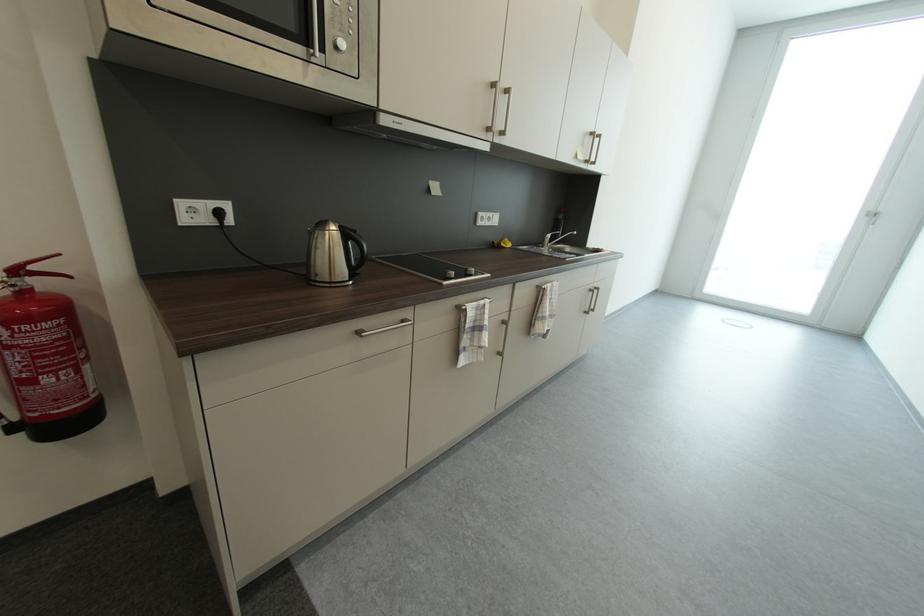
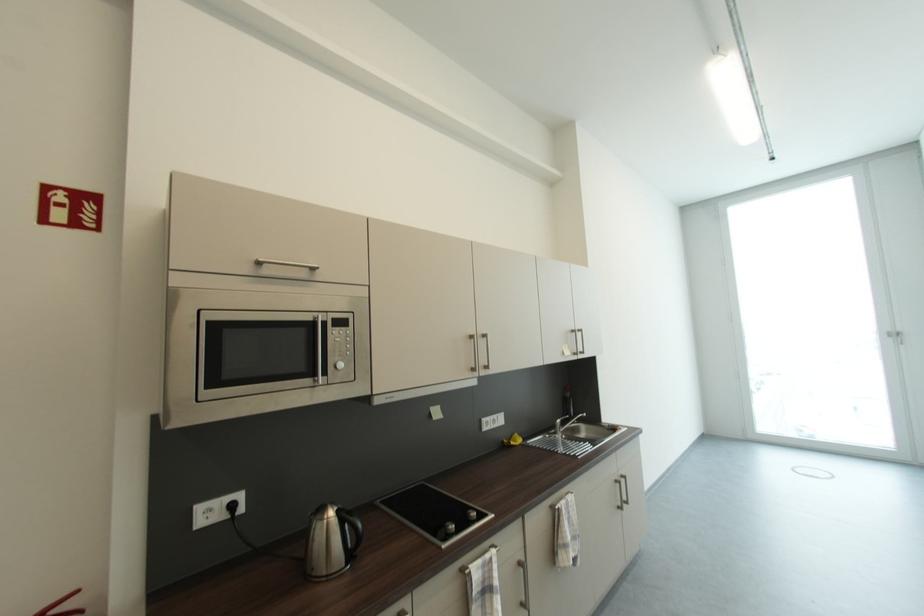
Question: Based on the continuous images, in which direction is the camera rotating? Reply with the corresponding letter.

Choices:
 (A) Left
 (B) Right
 (C) Up
 (D) Down

Answer: (C)